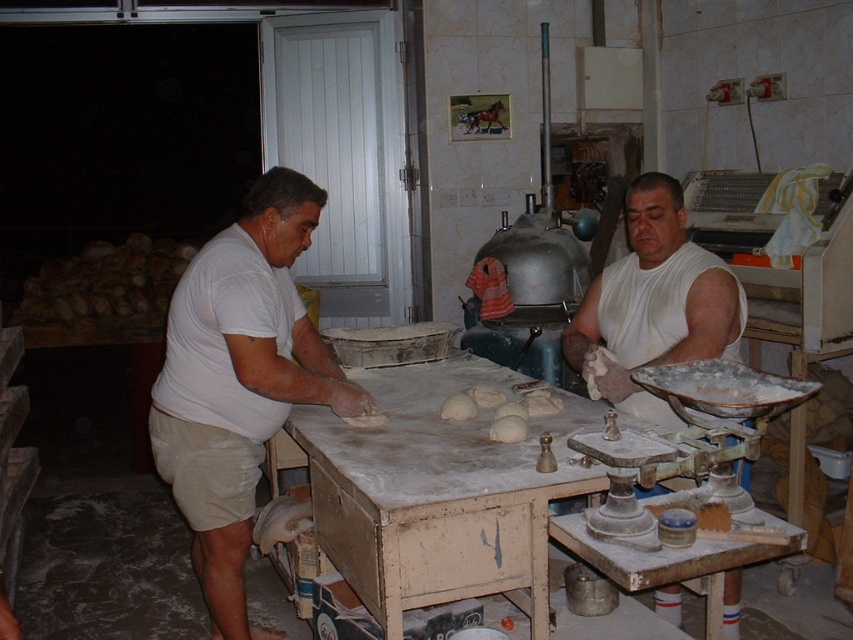
Question: Among these points, which one is farthest from the camera?

Choices:
 (A) (366, 582)
 (B) (250, 353)
 (C) (596, 337)

Answer: (C)

Question: Which of the following is the farthest from the observer?

Choices:
 (A) white matte shirt at left
 (B) white matte shirt at center
 (C) white wooden table at center

Answer: (B)

Question: Is white matte shirt at left bigger than white matte shirt at center?

Choices:
 (A) yes
 (B) no

Answer: (A)

Question: Is white wooden table at center above white matte shirt at left?

Choices:
 (A) yes
 (B) no

Answer: (B)

Question: Among these objects, which one is farthest from the camera?

Choices:
 (A) white wooden table at center
 (B) white matte shirt at center
 (C) white matte shirt at left

Answer: (B)

Question: Is white matte shirt at left positioned behind white matte shirt at center?

Choices:
 (A) yes
 (B) no

Answer: (B)